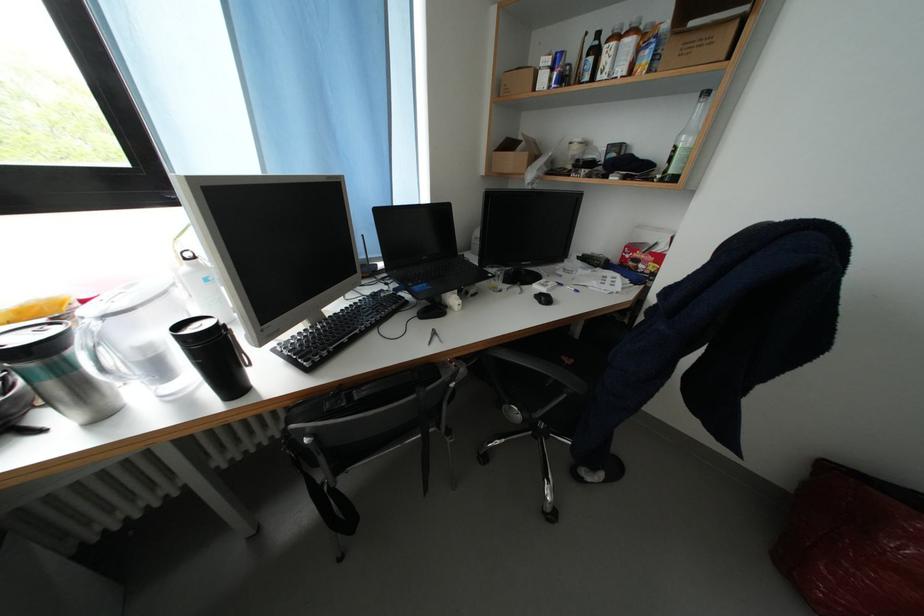
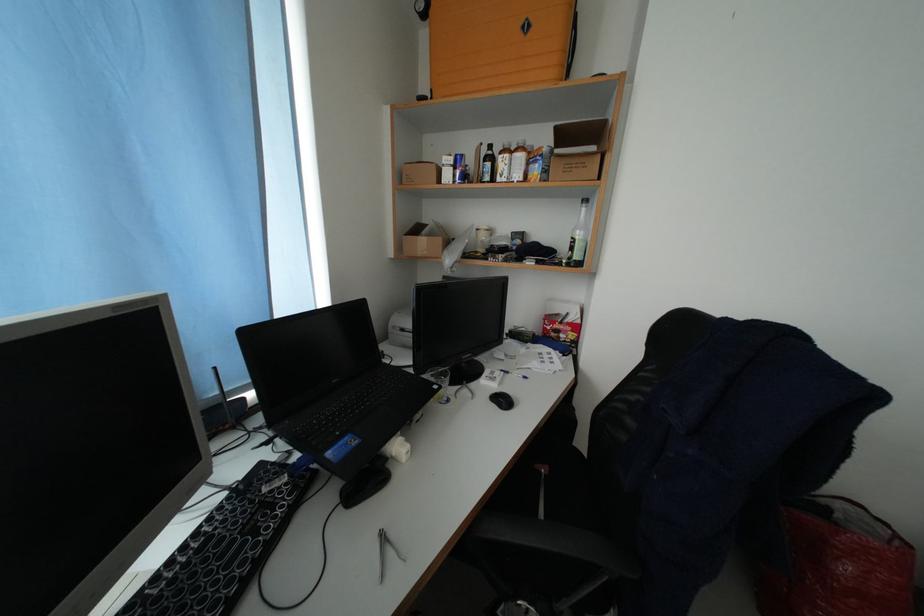
Question: I am providing you with two images of the same scene from different viewpoints. Which of the following objects are not visible in image2?

Choices:
 (A) red and white box
 (B) black chair armrest
 (C) metal pliers
 (D) none of these

Answer: (D)